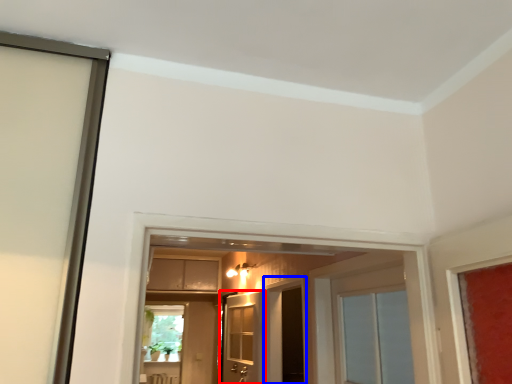
Question: Among these objects, which one is nearest to the camera, door (highlighted by a red box) or screen door (highlighted by a blue box)?

Choices:
 (A) door
 (B) screen door

Answer: (A)